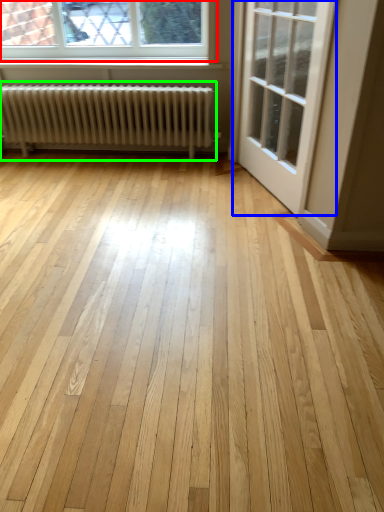
Question: Which object is positioned closest to window (highlighted by a red box)? Select from door (highlighted by a blue box) and radiator (highlighted by a green box).

Choices:
 (A) door
 (B) radiator

Answer: (B)